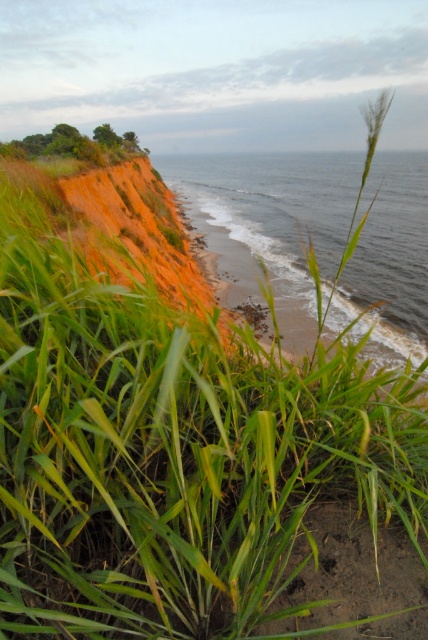
Can you confirm if blue water at center is smaller than green grass at upper left?

No, blue water at center is not smaller than green grass at upper left.

Can you confirm if blue water at center is positioned below green grass at upper left?

Indeed, blue water at center is positioned under green grass at upper left.

Locate an element on the screen. blue water at center is located at coordinates (270, 221).